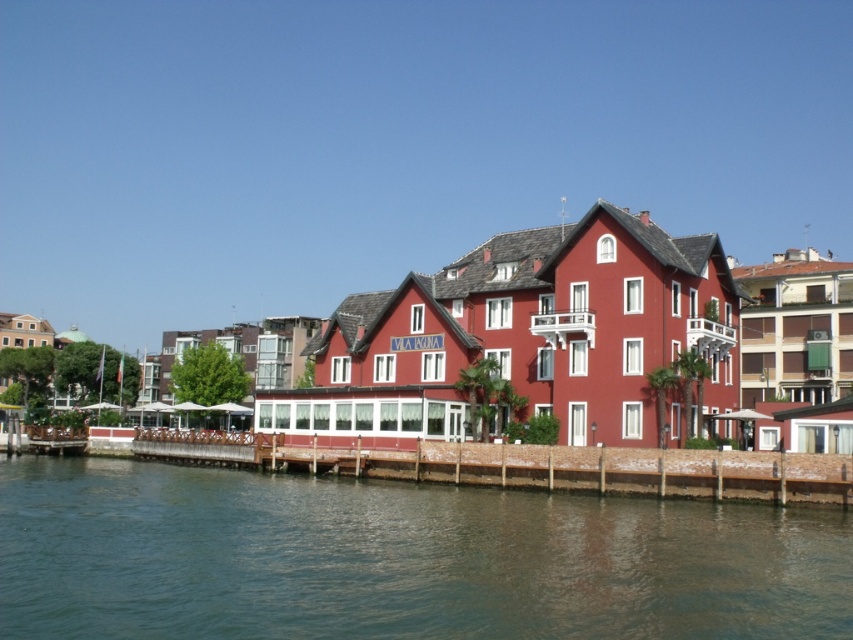
Question: Is greenish water at lower center wider than wooden dock at lower left?

Choices:
 (A) yes
 (B) no

Answer: (A)

Question: Which of the following is the closest to the observer?

Choices:
 (A) (798, 616)
 (B) (271, 428)
 (C) (498, 476)
 (D) (61, 419)

Answer: (A)

Question: Estimate the real-world distances between objects in this image. Which object is farther from the matte red building at center?

Choices:
 (A) greenish water at lower center
 (B) wooden dock at lower left
 (C) brown wooden dock at lower center

Answer: (B)

Question: Can you confirm if greenish water at lower center is positioned above matte red building at center?

Choices:
 (A) no
 (B) yes

Answer: (A)

Question: Based on their relative distances, which object is nearer to the greenish water at lower center?

Choices:
 (A) brown wooden dock at lower center
 (B) wooden dock at lower left
 (C) matte red building at center

Answer: (A)

Question: Does greenish water at lower center appear over matte red building at center?

Choices:
 (A) no
 (B) yes

Answer: (A)